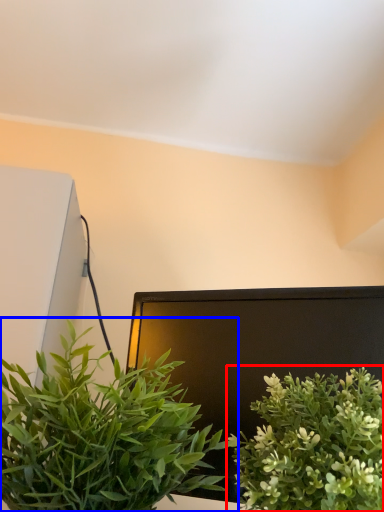
Question: Which object is further to the camera taking this photo, houseplant (highlighted by a red box) or houseplant (highlighted by a blue box)?

Choices:
 (A) houseplant
 (B) houseplant

Answer: (A)